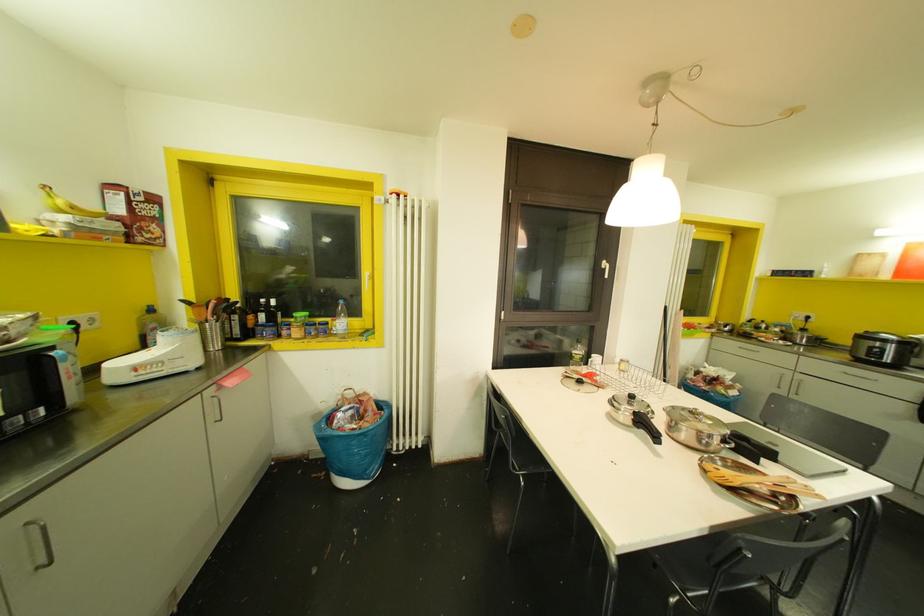
You are a GUI agent. You are given a task and a screenshot of the screen. Output one action in this format:
    pyautogui.click(x=<x>, y=<y>)
    Task: Click on the rice cooker handle
    The width and height of the screenshot is (924, 616).
    Given the screenshot: What is the action you would take?
    pyautogui.click(x=881, y=349)